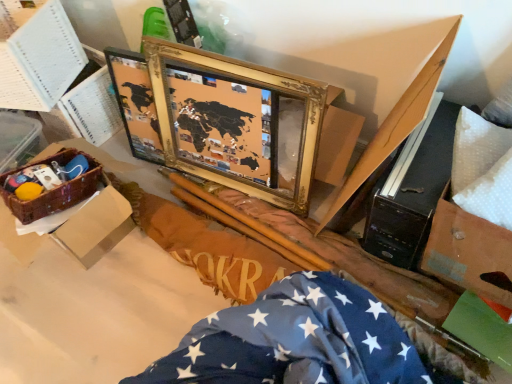
Question: Is blue fabric with white stars at lower right shorter than woven brown basket at lower left?

Choices:
 (A) no
 (B) yes

Answer: (A)

Question: From the image's perspective, is blue fabric with white stars at lower right above woven brown basket at lower left?

Choices:
 (A) yes
 (B) no

Answer: (B)

Question: Does blue fabric with white stars at lower right have a greater height compared to woven brown basket at lower left?

Choices:
 (A) yes
 (B) no

Answer: (A)

Question: Does blue fabric with white stars at lower right come behind woven brown basket at lower left?

Choices:
 (A) no
 (B) yes

Answer: (A)

Question: Is blue fabric with white stars at lower right surrounding woven brown basket at lower left?

Choices:
 (A) no
 (B) yes

Answer: (A)

Question: Is blue fabric with white stars at lower right wider or thinner than woven brown basket at lower left?

Choices:
 (A) thin
 (B) wide

Answer: (A)

Question: Looking at the image, does blue fabric with white stars at lower right seem bigger or smaller compared to woven brown basket at lower left?

Choices:
 (A) big
 (B) small

Answer: (A)

Question: In the image, is blue fabric with white stars at lower right positioned in front of or behind woven brown basket at lower left?

Choices:
 (A) front
 (B) behind

Answer: (A)

Question: Considering the positions of point (354, 302) and point (95, 188), is point (354, 302) closer or farther from the camera than point (95, 188)?

Choices:
 (A) closer
 (B) farther

Answer: (A)

Question: Based on their positions, is woven brown basket at lower left located to the left or right of brown woven basket at left, which appears as the first box when ordered from the bottom?

Choices:
 (A) left
 (B) right

Answer: (A)

Question: From their relative heights in the image, would you say woven brown basket at lower left is taller or shorter than brown woven basket at left, which appears as the first box when ordered from the bottom?

Choices:
 (A) tall
 (B) short

Answer: (B)

Question: Is point (95, 170) closer or farther from the camera than point (121, 228)?

Choices:
 (A) farther
 (B) closer

Answer: (B)

Question: Considering the positions of woven brown basket at lower left and brown woven basket at left, which appears as the first box when ordered from the bottom, in the image, is woven brown basket at lower left wider or thinner than brown woven basket at left, which appears as the first box when ordered from the bottom,?

Choices:
 (A) thin
 (B) wide

Answer: (A)

Question: Do you think white paper at upper left, which appears as the 2th box when ordered from the bottom, is within brown woven basket at left, which appears as the first box when ordered from the bottom, or outside of it?

Choices:
 (A) outside
 (B) inside

Answer: (A)

Question: In the image, is white paper at upper left, which appears as the 2th box when ordered from the bottom, positioned in front of or behind brown woven basket at left, the 2th box positioned from the top?

Choices:
 (A) front
 (B) behind

Answer: (B)